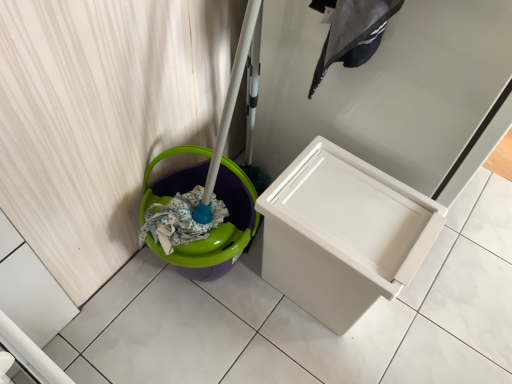
You are a GUI agent. You are given a task and a screenshot of the screen. Output one action in this format:
    pyautogui.click(x=<x>, y=<y>)
    Task: Click on the vacant space in front of white plastic waste container at center
    This screenshot has width=512, height=384.
    Given the screenshot: What is the action you would take?
    pyautogui.click(x=306, y=357)